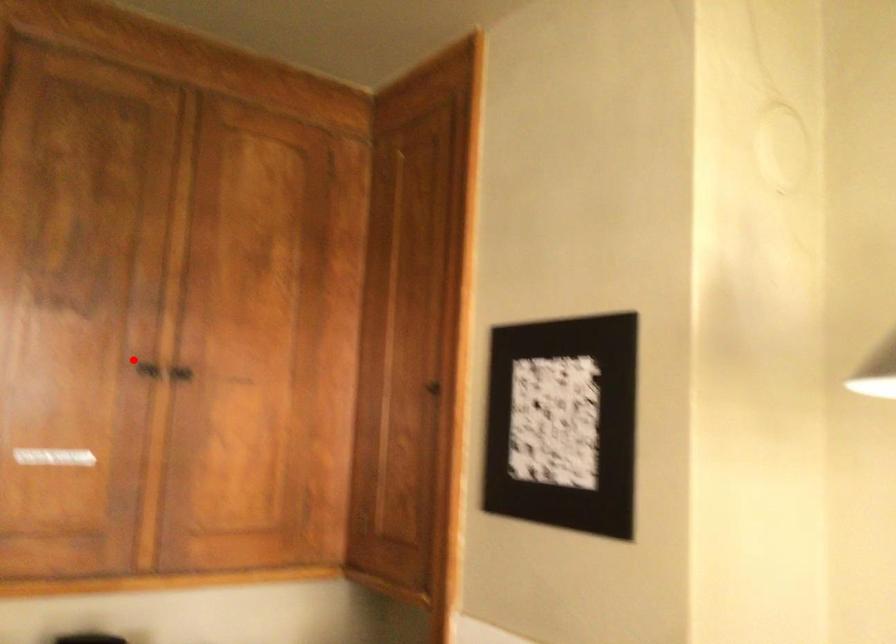
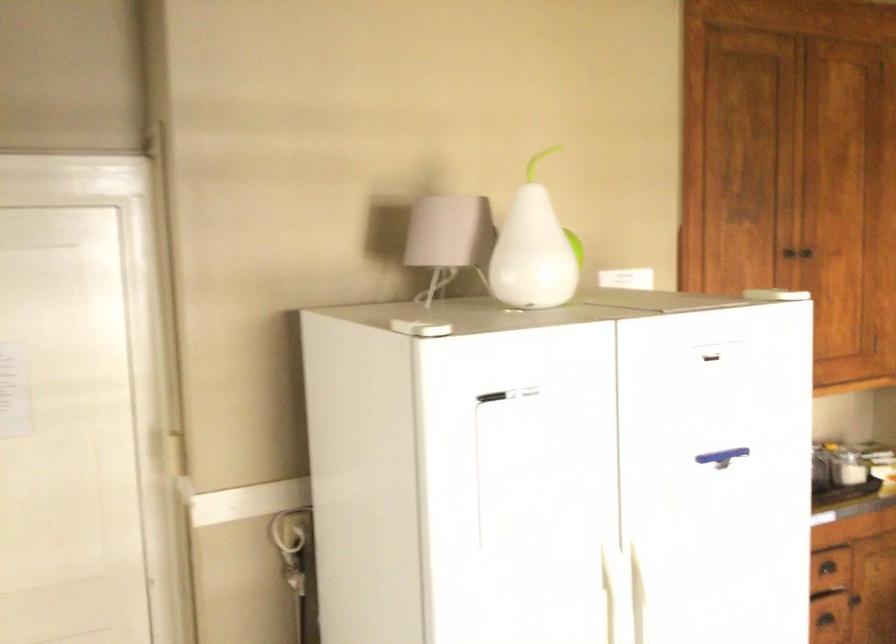
Question: I am providing you with two images of the same scene from different viewpoints. A red point is marked on the first image. Is the red point's position out of view in image 2?

Choices:
 (A) Yes
 (B) No

Answer: (B)